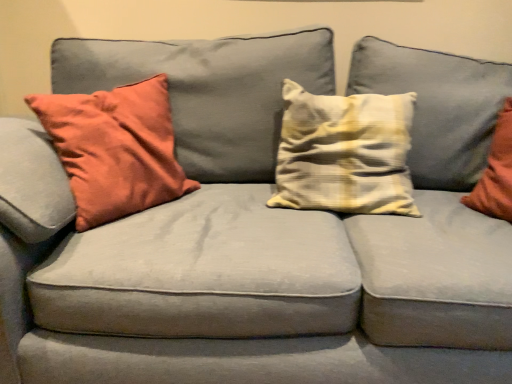
Question: From a real-world perspective, relative to yellow striped pillow at center, which is the 2th pillow from left to right, is matte orange pillow at left, the second pillow when ordered from right to left, vertically above or below?

Choices:
 (A) above
 (B) below

Answer: (B)

Question: Is matte orange pillow at left, which is counted as the 1th pillow, starting from the left, situated inside yellow striped pillow at center, which is the 2th pillow from left to right, or outside?

Choices:
 (A) inside
 (B) outside

Answer: (B)

Question: In terms of width, does matte orange pillow at left, the second pillow when ordered from right to left, look wider or thinner when compared to yellow striped pillow at center, which is the 1th pillow in right-to-left order?

Choices:
 (A) thin
 (B) wide

Answer: (B)

Question: Is yellow striped pillow at center, which is the 1th pillow in right-to-left order, in front of or behind matte orange pillow at left, the second pillow when ordered from right to left, in the image?

Choices:
 (A) behind
 (B) front

Answer: (A)

Question: Considering the relative positions of yellow striped pillow at center, which is the 2th pillow from left to right, and matte orange pillow at left, which is counted as the 1th pillow, starting from the left, in the image provided, is yellow striped pillow at center, which is the 2th pillow from left to right, to the left or to the right of matte orange pillow at left, which is counted as the 1th pillow, starting from the left,?

Choices:
 (A) left
 (B) right

Answer: (B)

Question: Considering the positions of yellow striped pillow at center, which is the 2th pillow from left to right, and matte orange pillow at left, which is counted as the 1th pillow, starting from the left, in the image, is yellow striped pillow at center, which is the 2th pillow from left to right, taller or shorter than matte orange pillow at left, which is counted as the 1th pillow, starting from the left,?

Choices:
 (A) short
 (B) tall

Answer: (A)

Question: Looking at their shapes, would you say yellow striped pillow at center, which is the 1th pillow in right-to-left order, is wider or thinner than matte orange pillow at left, the second pillow when ordered from right to left?

Choices:
 (A) wide
 (B) thin

Answer: (B)